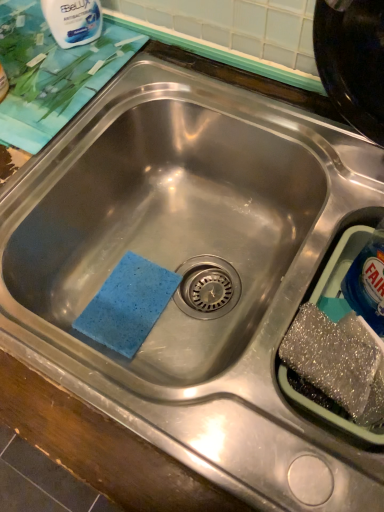
Where is `blue plastic bottle at right`? Image resolution: width=384 pixels, height=512 pixels. blue plastic bottle at right is located at coordinates (368, 282).

The image size is (384, 512). Describe the element at coordinates (368, 282) in the screenshot. I see `blue plastic bottle at right` at that location.

What do you see at coordinates (73, 21) in the screenshot?
I see `white glossy bottle at upper left` at bounding box center [73, 21].

Image resolution: width=384 pixels, height=512 pixels. Find the location of `white glossy bottle at upper left`. white glossy bottle at upper left is located at coordinates (73, 21).

Identify the location of blue plastic bottle at right. The height and width of the screenshot is (512, 384). (368, 282).

Is blue plastic bottle at right at the right side of white glossy bottle at upper left?

Correct, you'll find blue plastic bottle at right to the right of white glossy bottle at upper left.

Is blue plastic bottle at right behind white glossy bottle at upper left?

No, it is not.

Is point (379, 242) positioned before point (85, 17)?

Yes, point (379, 242) is in front of point (85, 17).

From the image's perspective, which is above, blue plastic bottle at right or white glossy bottle at upper left?

white glossy bottle at upper left, from the image's perspective.

From a real-world perspective, which object stands above the other?

In real-world perspective, white glossy bottle at upper left is above.

Looking at this image, considering the sizes of objects blue plastic bottle at right and white glossy bottle at upper left in the image provided, who is wider, blue plastic bottle at right or white glossy bottle at upper left?

Wider between the two is white glossy bottle at upper left.

Considering the sizes of objects blue plastic bottle at right and white glossy bottle at upper left in the image provided, who is shorter, blue plastic bottle at right or white glossy bottle at upper left?

white glossy bottle at upper left.

Looking at the image, does blue plastic bottle at right seem bigger or smaller compared to white glossy bottle at upper left?

Clearly, blue plastic bottle at right is larger in size than white glossy bottle at upper left.

Is blue plastic bottle at right not inside white glossy bottle at upper left?

That's correct, blue plastic bottle at right is outside of white glossy bottle at upper left.

Are blue plastic bottle at right and white glossy bottle at upper left far apart?

No, blue plastic bottle at right is in close proximity to white glossy bottle at upper left.

Is blue plastic bottle at right positioned with its back to white glossy bottle at upper left?

That's not correct — blue plastic bottle at right is not looking away from white glossy bottle at upper left.

In order to click on cleaning product above the blue plastic bottle at right (from a real-world perspective) in this screenshot , I will do `click(73, 21)`.

Considering the relative positions of white glossy bottle at upper left and blue plastic bottle at right in the image provided, is white glossy bottle at upper left to the left of blue plastic bottle at right from the viewer's perspective?

Correct, you'll find white glossy bottle at upper left to the left of blue plastic bottle at right.

Is white glossy bottle at upper left further to camera compared to blue plastic bottle at right?

Yes, white glossy bottle at upper left is behind blue plastic bottle at right.

Which is behind, point (71, 30) or point (374, 263)?

The point (71, 30) is farther.

From the image's perspective, which object appears higher, white glossy bottle at upper left or blue plastic bottle at right?

white glossy bottle at upper left.

Looking at this image, from a real-world perspective, does white glossy bottle at upper left sit lower than blue plastic bottle at right?

Incorrect, from a real-world perspective, white glossy bottle at upper left is higher than blue plastic bottle at right.

Is white glossy bottle at upper left thinner than blue plastic bottle at right?

Incorrect, the width of white glossy bottle at upper left is not less than that of blue plastic bottle at right.

Based on the photo, between white glossy bottle at upper left and blue plastic bottle at right, which one has more height?

Standing taller between the two is blue plastic bottle at right.

Based on their sizes in the image, would you say white glossy bottle at upper left is bigger or smaller than blue plastic bottle at right?

Clearly, white glossy bottle at upper left is smaller in size than blue plastic bottle at right.

Which is correct: white glossy bottle at upper left is inside blue plastic bottle at right, or outside of it?

white glossy bottle at upper left exists outside the volume of blue plastic bottle at right.

Is white glossy bottle at upper left far from blue plastic bottle at right?

No.

Looking at this image, could you tell me if white glossy bottle at upper left is facing blue plastic bottle at right?

No, white glossy bottle at upper left is not oriented towards blue plastic bottle at right.

From the picture: Can you tell me how much white glossy bottle at upper left and blue plastic bottle at right differ in facing direction?

There is a 37.4-degree angle between the facing directions of white glossy bottle at upper left and blue plastic bottle at right.

Image resolution: width=384 pixels, height=512 pixels. In order to click on cleaning product on the left of blue plastic bottle at right in this screenshot , I will do `click(73, 21)`.

This screenshot has width=384, height=512. Find the location of `cleaning product above the blue plastic bottle at right (from the image's perspective)`. cleaning product above the blue plastic bottle at right (from the image's perspective) is located at coordinates (73, 21).

The height and width of the screenshot is (512, 384). I want to click on cleaning product above the blue plastic bottle at right (from a real-world perspective), so click(x=73, y=21).